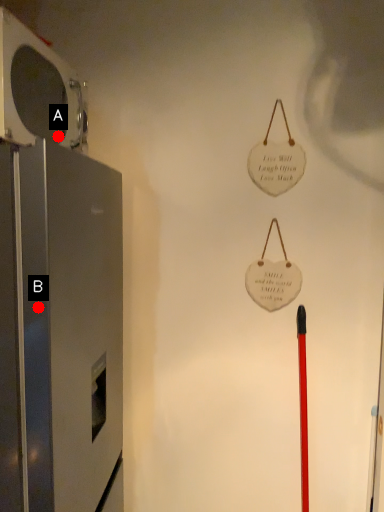
Question: Two points are circled on the image, labeled by A and B beside each circle. Which point is farther to the camera?

Choices:
 (A) A is further
 (B) B is further

Answer: (A)